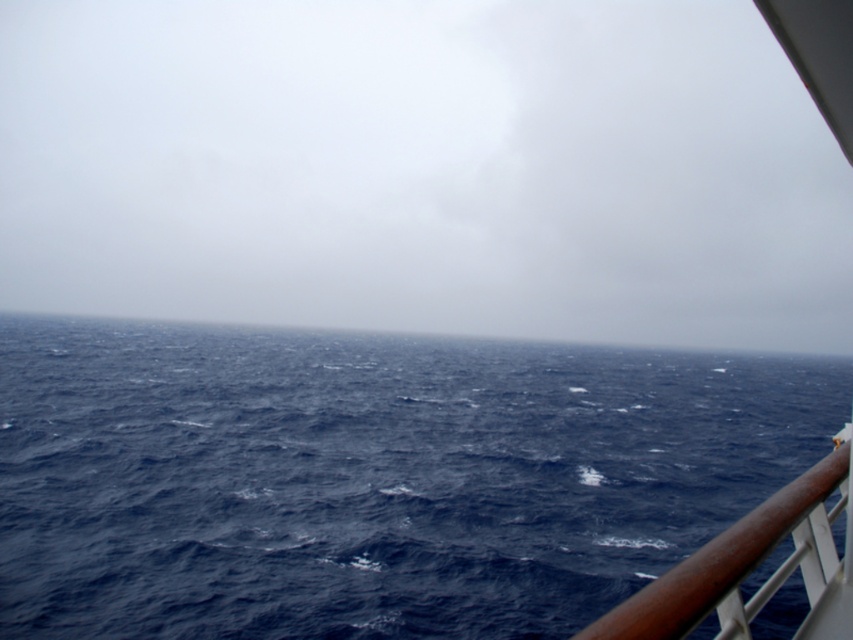
Which is in front, point (781, 582) or point (631, 348)?

Positioned in front is point (781, 582).

Can you confirm if brown polished wood at right is positioned below blue water at center?

Actually, brown polished wood at right is above blue water at center.

Measure the distance between brown polished wood at right and camera.

5.67 feet

Where is `brown polished wood at right`? This screenshot has height=640, width=853. brown polished wood at right is located at coordinates (740, 563).

Does dark blue water at center appear over brown polished wood at right?

No.

Find the location of a particular element. The width and height of the screenshot is (853, 640). dark blue water at center is located at coordinates (370, 476).

Who is more forward, (x=523, y=486) or (x=828, y=484)?

Positioned in front is point (x=828, y=484).

You are a GUI agent. You are given a task and a screenshot of the screen. Output one action in this format:
    pyautogui.click(x=<x>, y=<y>)
    Task: Click on the dark blue water at center
    The height and width of the screenshot is (640, 853).
    Given the screenshot: What is the action you would take?
    pyautogui.click(x=370, y=476)

Can you confirm if dark blue water at center is bigger than blue water at center?

Incorrect, dark blue water at center is not larger than blue water at center.

Which is in front, point (210, 628) or point (490, 339)?

Point (210, 628) is in front.

Identify the location of dark blue water at center. (370, 476).